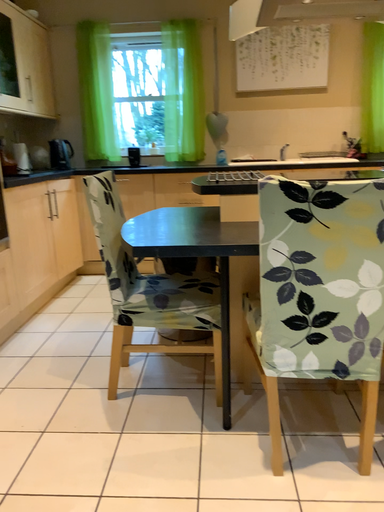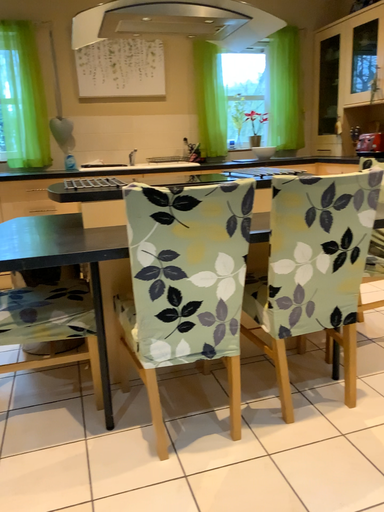
Question: How did the camera likely rotate when shooting the video?

Choices:
 (A) rotated left
 (B) rotated right

Answer: (B)